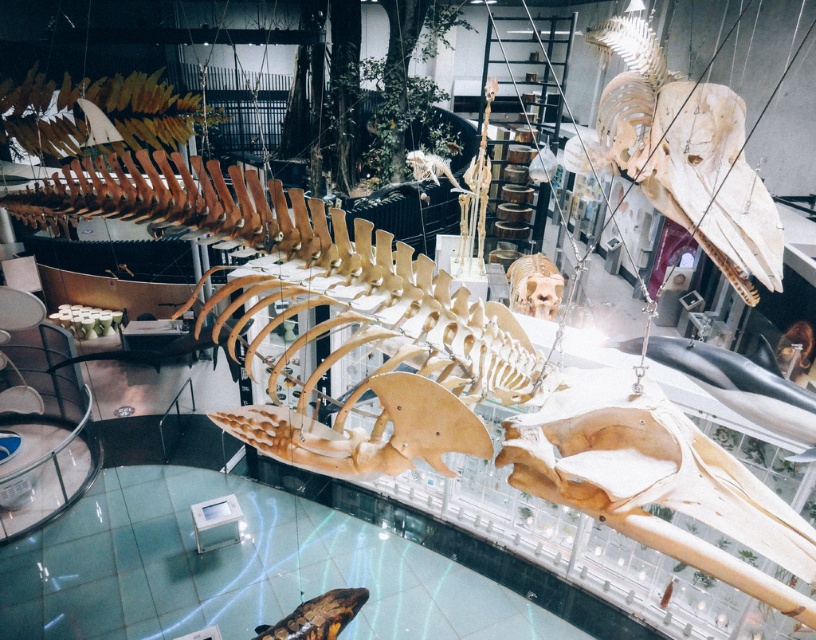
Question: Is brown matte skull at lower center to the left of brown matte skull at center from the viewer's perspective?

Choices:
 (A) yes
 (B) no

Answer: (A)

Question: Which is farther from the brown matte skull at center?

Choices:
 (A) brown matte skull at lower center
 (B) transparent glass table at lower center
 (C) light brown bone at upper center

Answer: (A)

Question: Which of these objects is positioned closest to the smooth gray dolphin at center?

Choices:
 (A) transparent glass table at lower center
 (B) brown matte skull at center
 (C) light brown bone at upper center

Answer: (C)

Question: Is transparent glass table at lower center bigger than light brown bone at upper center?

Choices:
 (A) no
 (B) yes

Answer: (A)

Question: Which object is positioned farthest from the brown matte skull at lower center?

Choices:
 (A) smooth gray dolphin at center
 (B) brown matte skull at center
 (C) transparent glass table at lower center

Answer: (B)

Question: Can you confirm if smooth gray dolphin at center is positioned above brown matte skull at center?

Choices:
 (A) no
 (B) yes

Answer: (A)